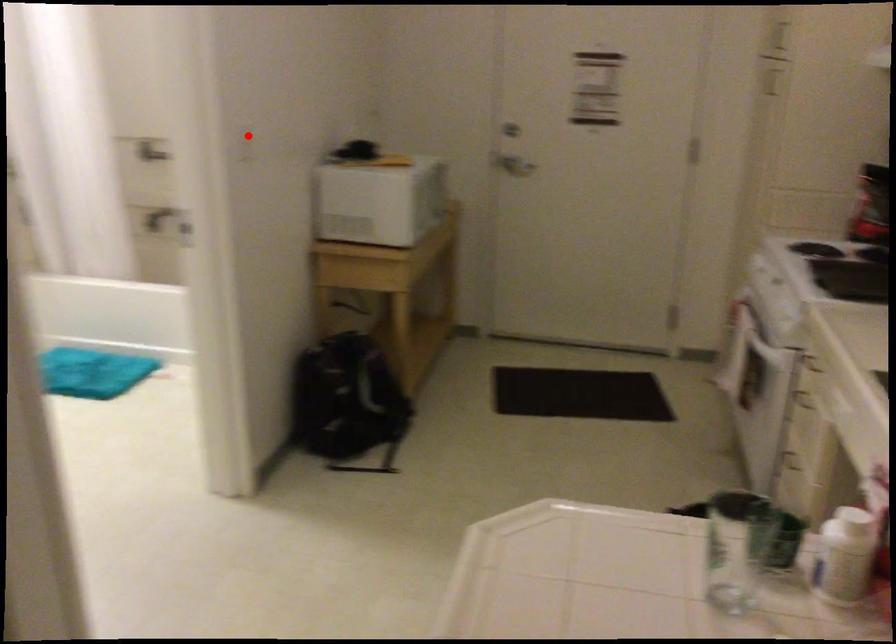
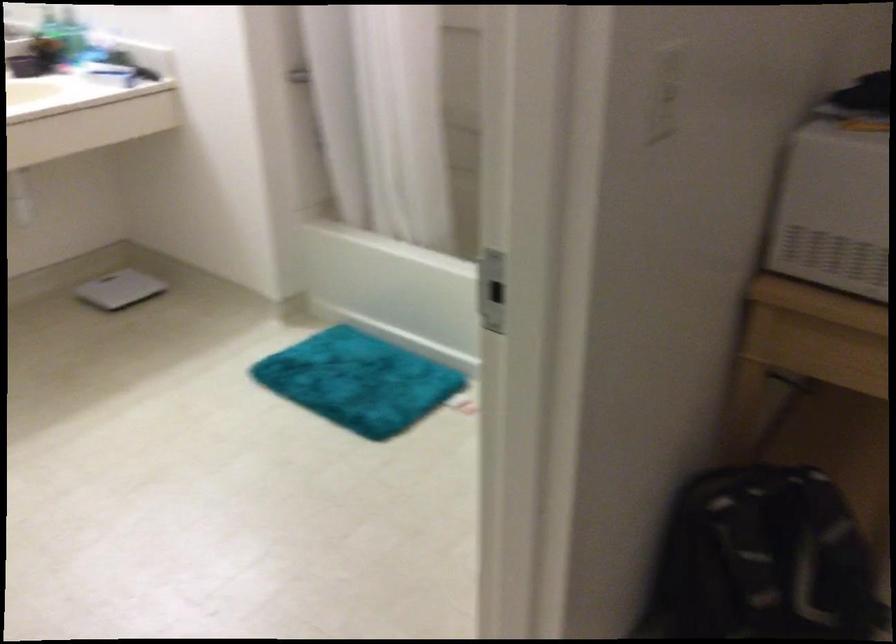
Question: I am providing you with two images of the same scene from different viewpoints. Given a red point in image1, look at the same physical point in image2. Is it:

Choices:
 (A) Closer to the viewpoint
 (B) Farther from the viewpoint

Answer: (A)